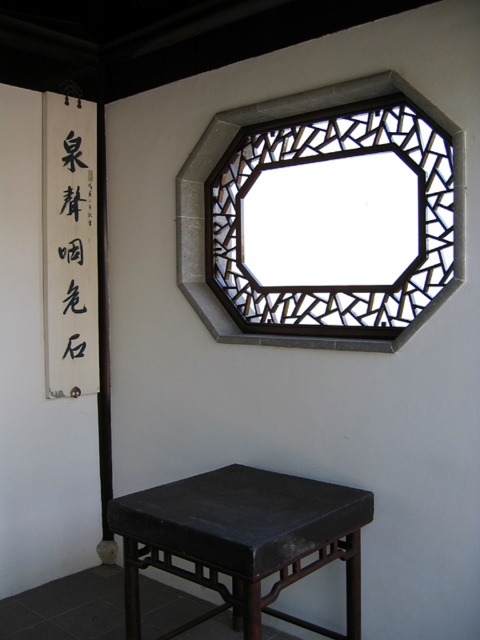
Question: Where is black lattice window at upper center located in relation to black paper calligraphy at left in the image?

Choices:
 (A) left
 (B) right

Answer: (B)

Question: Which of the following is the closest to the observer?

Choices:
 (A) (432, 301)
 (B) (72, 200)
 (C) (91, 296)

Answer: (A)

Question: Is matte black table at lower center bigger than black paper calligraphy at left?

Choices:
 (A) yes
 (B) no

Answer: (A)

Question: Estimate the real-world distances between objects in this image. Which object is farther from the white paper sign at left?

Choices:
 (A) matte black table at lower center
 (B) black lattice window at upper center
 (C) black paper calligraphy at left

Answer: (A)

Question: Which object is positioned closest to the black lattice window at upper center?

Choices:
 (A) black paper calligraphy at left
 (B) matte black table at lower center
 (C) white paper sign at left

Answer: (C)

Question: Observing the image, what is the correct spatial positioning of matte black table at lower center in reference to white paper sign at left?

Choices:
 (A) above
 (B) below

Answer: (B)